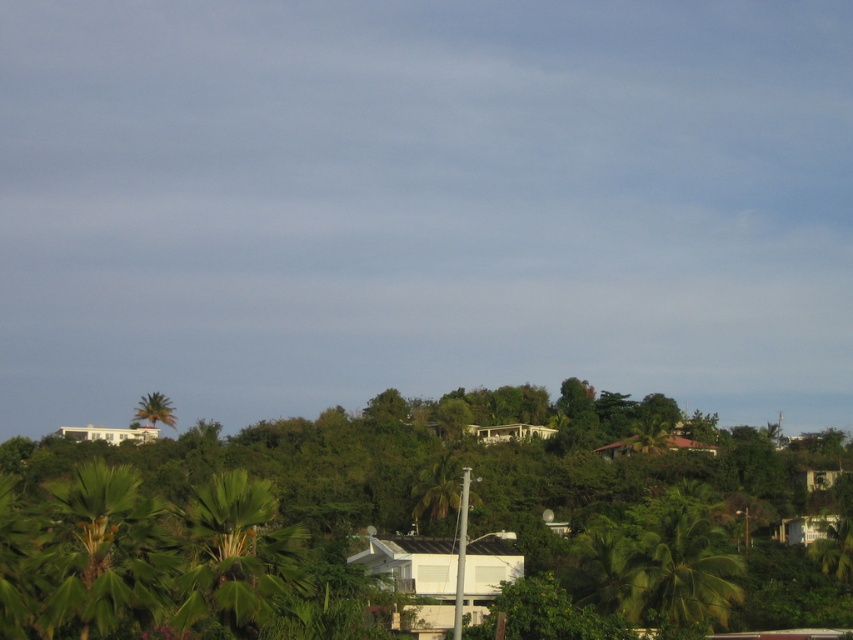
Which is in front, point (409, 500) or point (683, 547)?

Positioned in front is point (683, 547).

Is green leafy tree at center positioned before green leafy tree at lower right?

Yes, green leafy tree at center is closer to the viewer.

Between point (546, 406) and point (703, 621), which one is positioned in front?

Point (703, 621) is more forward.

Locate an element on the screen. This screenshot has width=853, height=640. green leafy tree at center is located at coordinates (393, 525).

Is green leafy tree at lower right bigger than green leafy palm tree at upper left?

No, green leafy tree at lower right is not bigger than green leafy palm tree at upper left.

Can you confirm if green leafy tree at lower right is taller than green leafy palm tree at upper left?

Incorrect, green leafy tree at lower right's height is not larger of green leafy palm tree at upper left's.

Who is more forward, (618,545) or (161,410)?

Positioned in front is point (618,545).

Locate an element on the screen. Image resolution: width=853 pixels, height=640 pixels. green leafy tree at lower right is located at coordinates (675, 572).

Describe the element at coordinates (393, 525) in the screenshot. I see `green leafy tree at center` at that location.

Between green leafy tree at center and green leafy palm tree at upper left, which one is positioned higher?

green leafy tree at center

Measure the distance between point (x=531, y=448) and camera.

Point (x=531, y=448) and camera are 559.31 feet apart from each other.

The width and height of the screenshot is (853, 640). I want to click on green leafy tree at center, so click(393, 525).